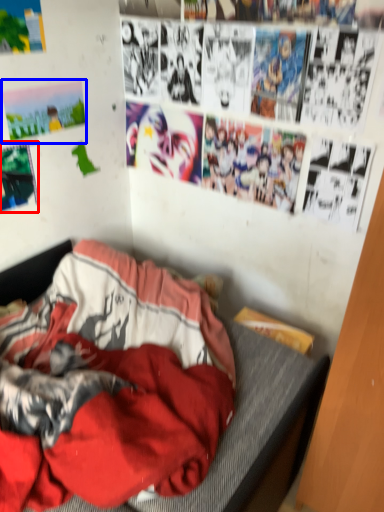
Question: Which object is closer to the camera taking this photo, poster page (highlighted by a red box) or poster page (highlighted by a blue box)?

Choices:
 (A) poster page
 (B) poster page

Answer: (A)